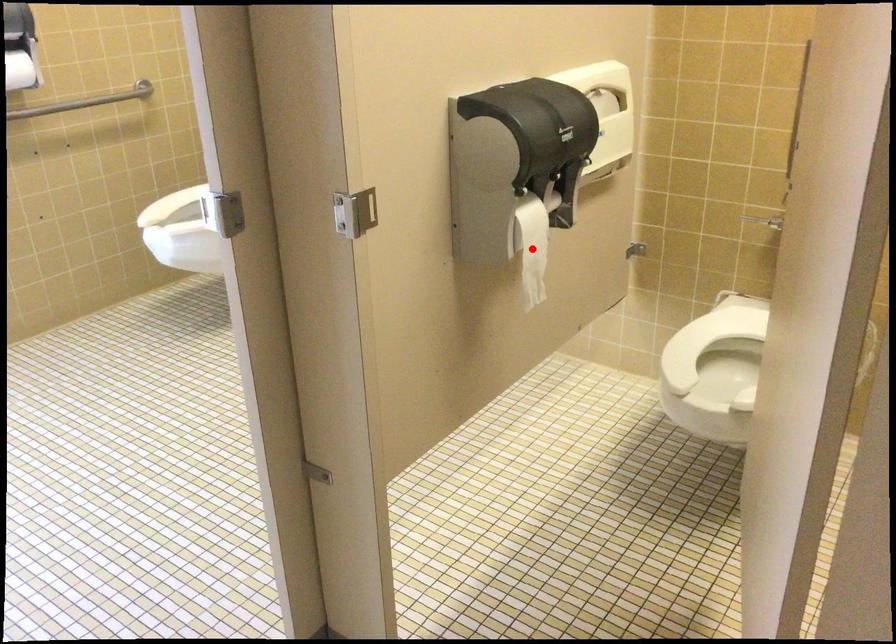
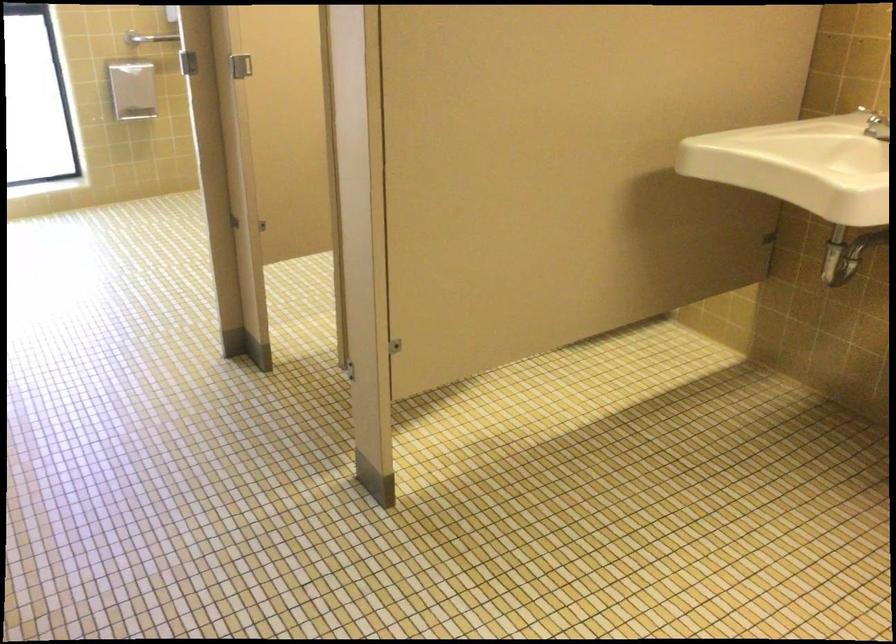
Question: I am providing you with two images of the same scene from different viewpoints. A red point is marked on the first image. Is the red point's position out of view in image 2?

Choices:
 (A) Yes
 (B) No

Answer: (A)